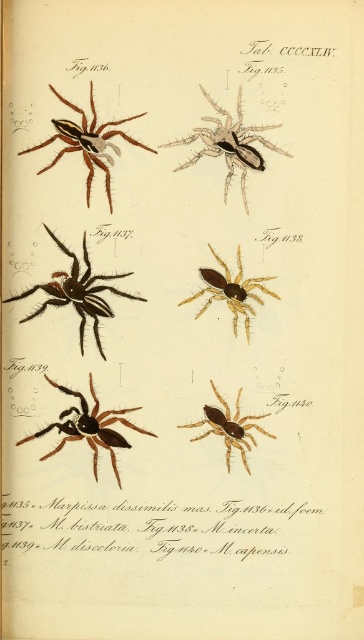
Based on the image from the scientific publication labeled Tab. CCCXLIV, there are six spider illustrations arranged in two columns and three rows. You notice a point marked at coordinates [89,428]. Which spider does this point indicate?

The point at coordinates [89,428] indicates the shiny brown spider at center.